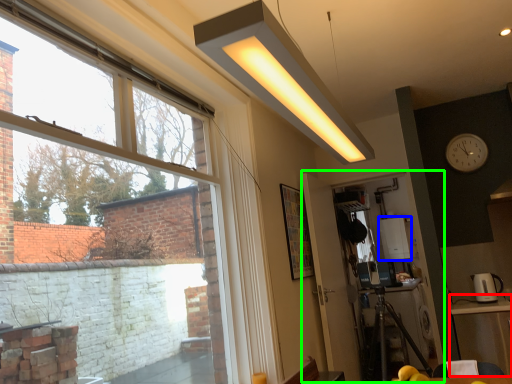
Question: Which object is the farthest from table (highlighted by a red box)? Choose among these: appliance (highlighted by a blue box) or screen door (highlighted by a green box).

Choices:
 (A) appliance
 (B) screen door

Answer: (A)